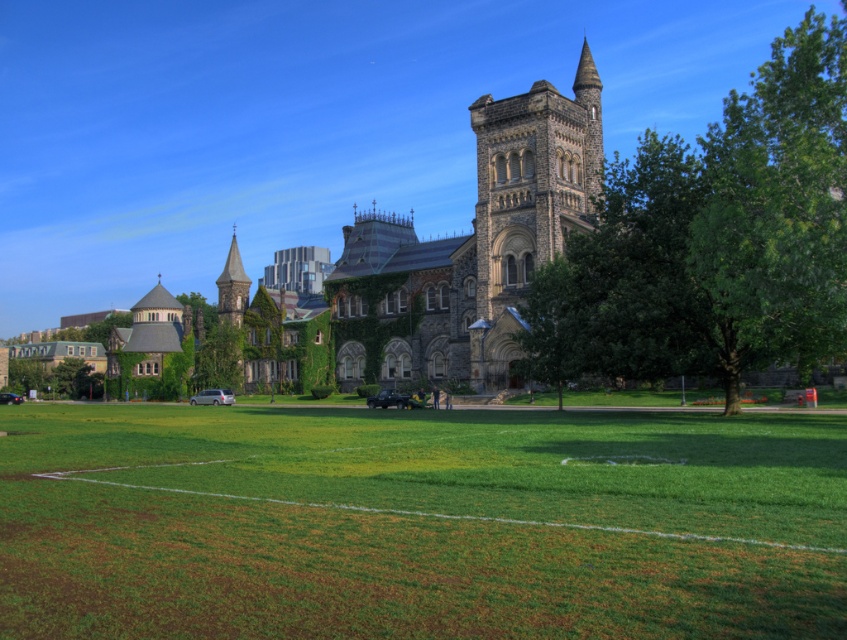
You are standing at the edge of the green grass field at center and want to throw a ball to a friend who is standing at the opposite edge. How far will the ball have to travel to reach them?

The green grass field at center and viewer are 26.56 meters apart from each other, so the ball will need to travel 26.56 meters to reach your friend at the opposite edge.

You are standing at the base of the central tower of the historic stone building and want to walk to the point marked by point (x=472, y=310). There is an obstacle at point (x=818, y=67). Will you encounter this obstacle on your way?

Since point (x=818, y=67) is in front of point (x=472, y=310), you will encounter the obstacle at point (x=818, y=67) on your way to point (x=472, y=310).